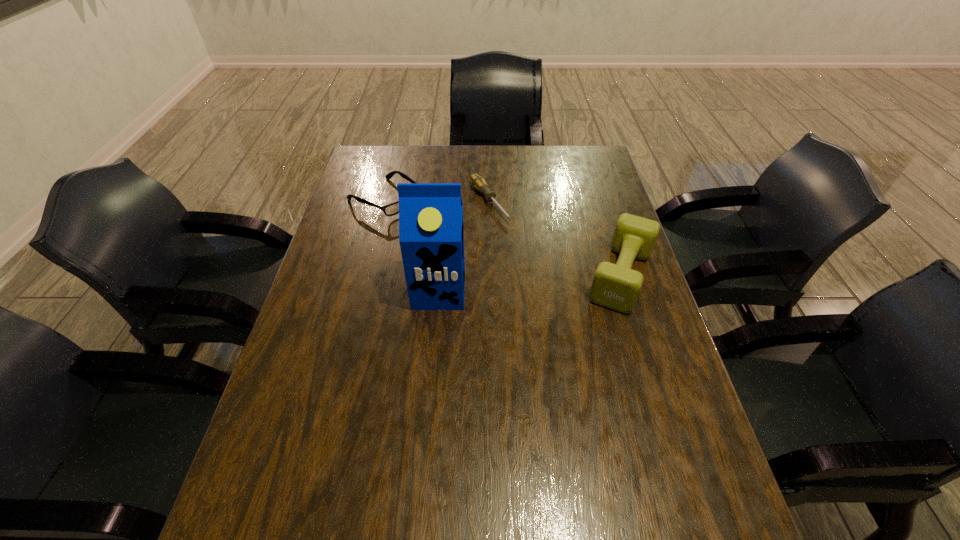
This screenshot has width=960, height=540. What are the coordinates of `free spot on the desktop that is between the carton and the dumbbell and is positioned at the tip of the second object from right to left` in the screenshot? It's located at (557, 281).

The height and width of the screenshot is (540, 960). I want to click on vacant space on the desktop that is between the tallest object and the third shortest object and is positioned on the front-facing side of the second shortest object, so click(523, 284).